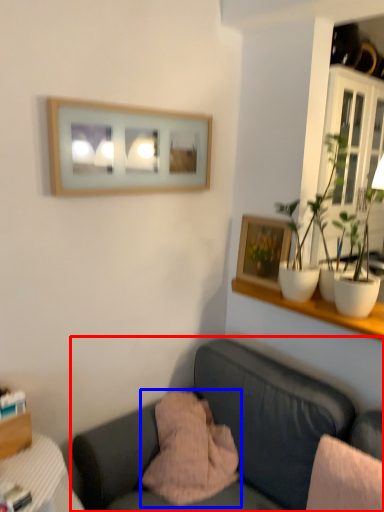
Question: Which point is further to the camera, studio couch (highlighted by a red box) or pillow (highlighted by a blue box)?

Choices:
 (A) studio couch
 (B) pillow

Answer: (B)